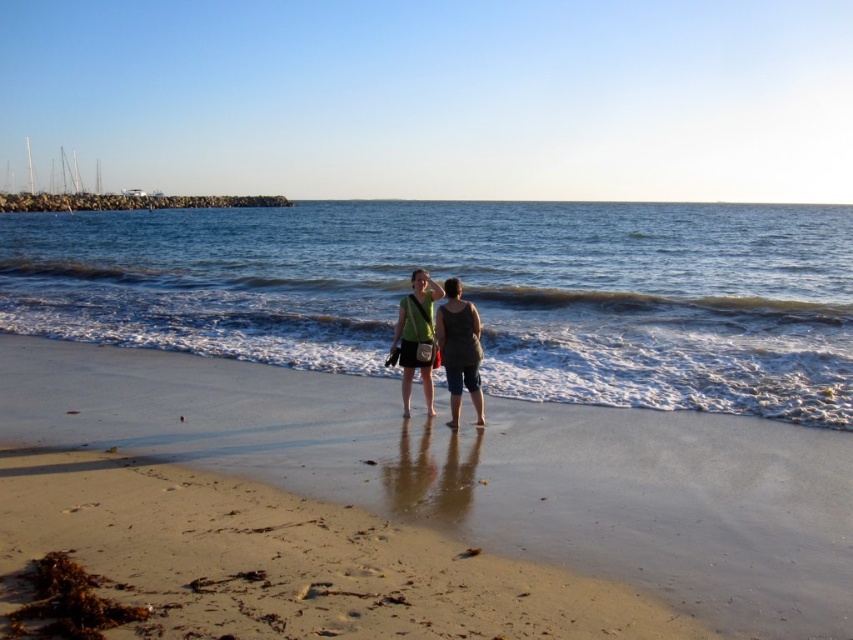
Question: Is sandy beach at center smaller than green fabric dress at center?

Choices:
 (A) yes
 (B) no

Answer: (B)

Question: Is green fabric dress at center to the left of matte gray tank top at center from the viewer's perspective?

Choices:
 (A) no
 (B) yes

Answer: (B)

Question: Considering the real-world distances, which object is farthest from the matte gray tank top at center?

Choices:
 (A) green fabric dress at center
 (B) clear blue water at center

Answer: (B)

Question: Can you confirm if clear blue water at center is positioned to the right of sandy beach at center?

Choices:
 (A) yes
 (B) no

Answer: (A)

Question: Which of the following is the farthest from the observer?

Choices:
 (A) (775, 548)
 (B) (190, 324)
 (C) (437, 308)
 (D) (448, 317)

Answer: (B)

Question: Which object is positioned closest to the matte gray tank top at center?

Choices:
 (A) sandy beach at center
 (B) green fabric dress at center

Answer: (B)